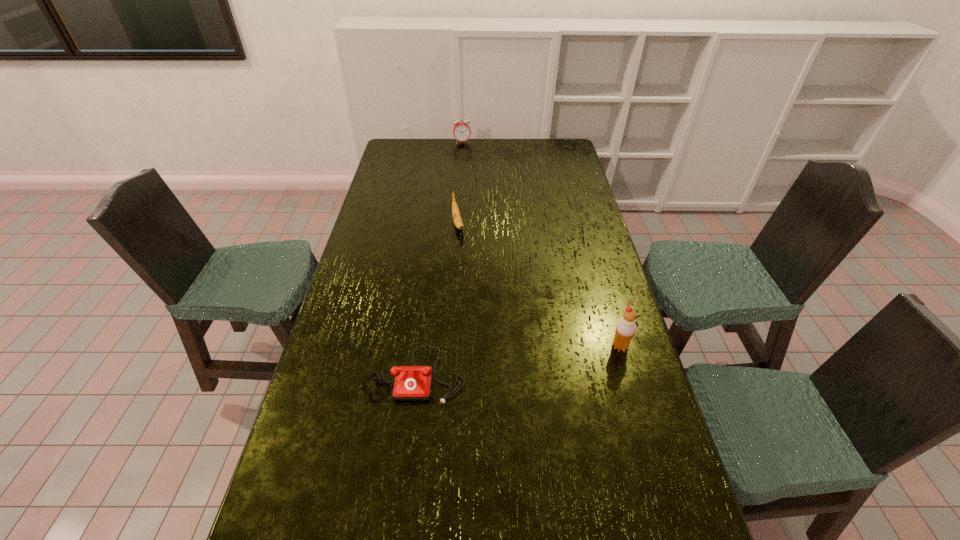
Identify the location of free space at the right edge of the desktop. The width and height of the screenshot is (960, 540). (573, 238).

Find the location of a particular element. The image size is (960, 540). vacant space at the near left corner of the desktop is located at coordinates (317, 497).

Locate an element on the screen. vacant space at the far right corner is located at coordinates (544, 154).

Locate an element on the screen. The image size is (960, 540). free area in between the third tallest object and the telephone is located at coordinates (436, 299).

The width and height of the screenshot is (960, 540). What are the coordinates of `vacant area between the second tallest object and the telephone` in the screenshot? It's located at (438, 258).

Locate an element on the screen. The height and width of the screenshot is (540, 960). unoccupied area between the third tallest object and the tallest object is located at coordinates (539, 285).

Find the location of `vacant area that lies between the banana and the shortest object`. vacant area that lies between the banana and the shortest object is located at coordinates (436, 299).

You are a GUI agent. You are given a task and a screenshot of the screen. Output one action in this format:
    pyautogui.click(x=<x>, y=<y>)
    Task: Click on the free space that is in between the rightmost object and the telephone
    This screenshot has width=960, height=540.
    Given the screenshot: What is the action you would take?
    pyautogui.click(x=516, y=360)

Identify the location of vacant space that is in between the tallest object and the third nearest object. Image resolution: width=960 pixels, height=540 pixels. (539, 285).

Find the location of a particular element. empty space that is in between the rightmost object and the third shortest object is located at coordinates (540, 245).